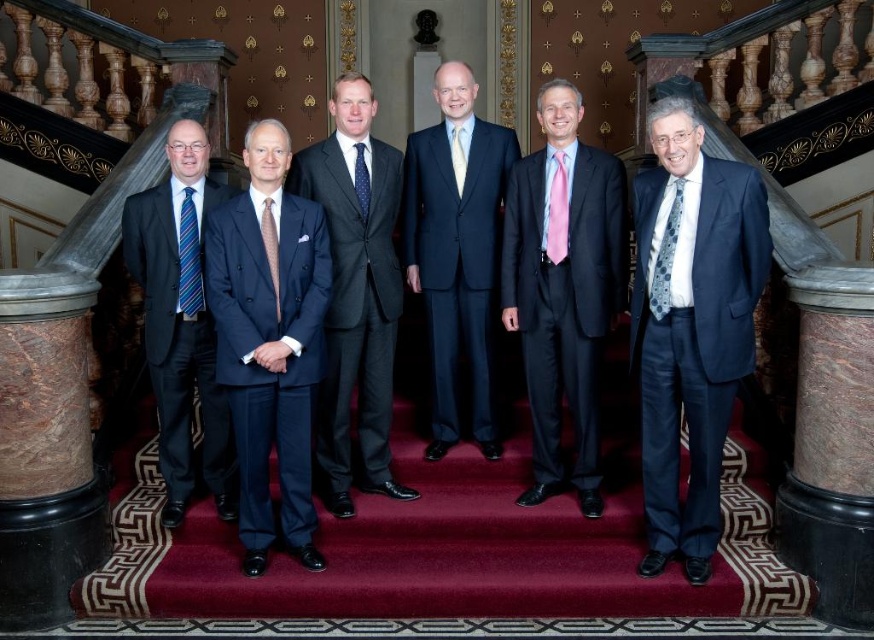
You are standing in front of a group of six men on a staircase in a grand hall. You notice two specific points marked as point 1 at coordinates (594, 237) and point 2 at coordinates (389, 262). Which of these points is nearer to you?

Point 1 at coordinates (594, 237) is closer to the viewer than point 2 at coordinates (389, 262).

You are a photographer standing at the bottom of the staircase. You want to take a photo of the pink silk tie at center and the dark gray suit at center such that both are clearly visible. Given that your camera has a minimum focus distance of 1 meter, will you be able to capture both objects in focus without moving closer?

The pink silk tie at center and dark gray suit at center are 1.13 meters apart from each other. Since the distance between them is greater than the camera minimum focus distance of 1 meter, the camera can capture both objects in focus without moving closer.